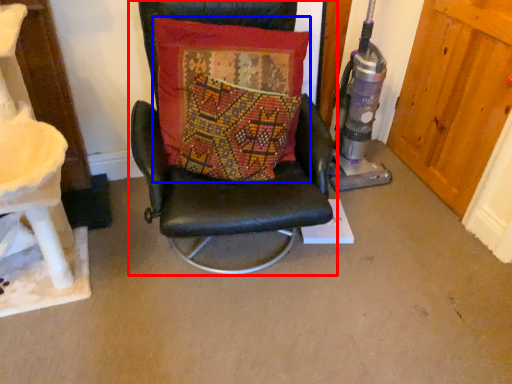
Question: Among these objects, which one is farthest to the camera, chair (highlighted by a red box) or pillow (highlighted by a blue box)?

Choices:
 (A) chair
 (B) pillow

Answer: (B)